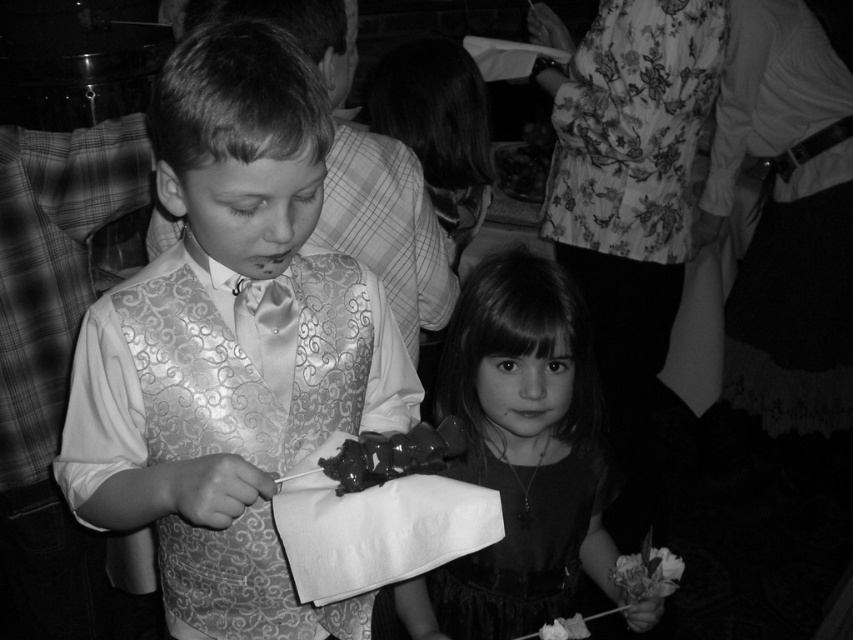
Question: Which of the following is the farthest from the observer?

Choices:
 (A) (369, 445)
 (B) (318, 436)

Answer: (B)

Question: From the image, what is the correct spatial relationship of smooth black dress at center in relation to silky satin vest at center?

Choices:
 (A) below
 (B) above

Answer: (A)

Question: Considering the relative positions of satin vest at left and shiny dark chocolate at lower center in the image provided, where is satin vest at left located with respect to shiny dark chocolate at lower center?

Choices:
 (A) above
 (B) below

Answer: (B)

Question: Is silky satin vest at center thinner than shiny dark chocolate at lower center?

Choices:
 (A) yes
 (B) no

Answer: (B)

Question: Estimate the real-world distances between objects in this image. Which object is farther from the shiny dark chocolate at lower center?

Choices:
 (A) smooth black dress at center
 (B) silky satin vest at center
 (C) satin vest at left

Answer: (B)

Question: Which of the following is the farthest from the observer?

Choices:
 (A) smooth black dress at center
 (B) silky satin vest at center

Answer: (A)